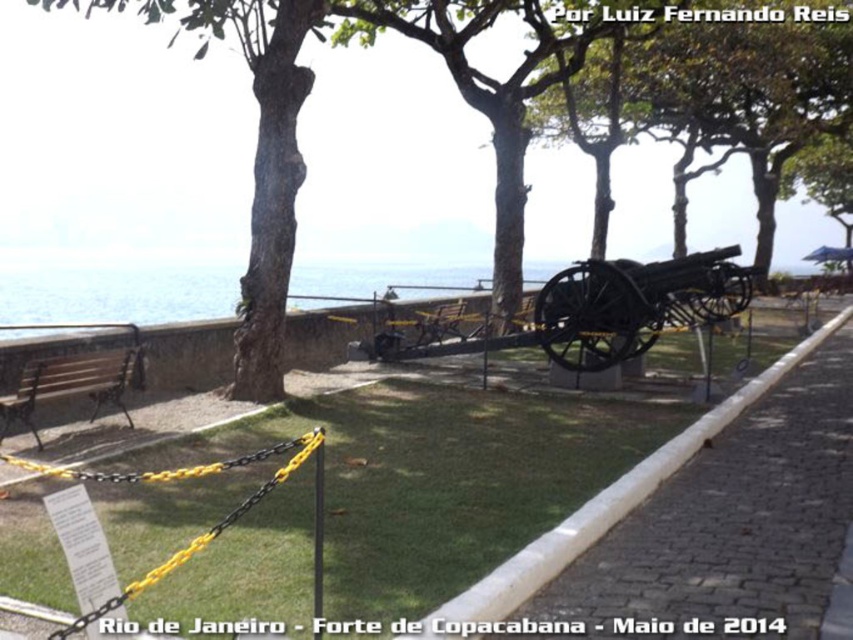
Between blue water at center and polished metal bench at lower left, which one is positioned higher?

blue water at center is higher up.

Which is behind, point (61, 316) or point (115, 364)?

The point (61, 316) is more distant.

Where is `blue water at center`? The height and width of the screenshot is (640, 853). blue water at center is located at coordinates (x=119, y=292).

Measure the distance between brown wood tree at center and black metal cannon at center.

brown wood tree at center is 9.94 meters from black metal cannon at center.

Between point (366, 208) and point (584, 355), which one is positioned in front?

Positioned in front is point (584, 355).

Find the location of a particular element. This screenshot has width=853, height=640. brown wood tree at center is located at coordinates (328, 138).

Between brown wood tree at center and polished metal bench at lower left, which one has more height?

With more height is brown wood tree at center.

Is brown wood tree at center taller than polished metal bench at lower left?

Correct, brown wood tree at center is much taller as polished metal bench at lower left.

Where is `brown wood tree at center`? This screenshot has height=640, width=853. brown wood tree at center is located at coordinates 328,138.